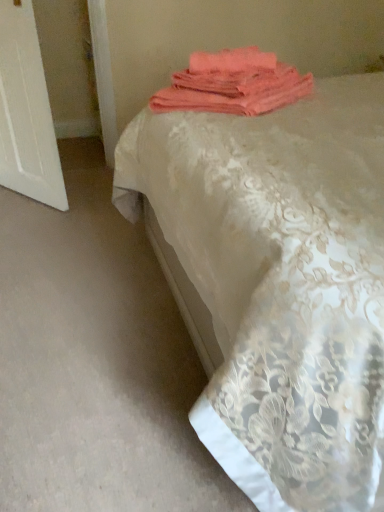
Question: Is point (4, 138) positioned closer to the camera than point (294, 68)?

Choices:
 (A) farther
 (B) closer

Answer: (B)

Question: From the image's perspective, relative to coral fabric towel at upper center, is white wood door at left above or below?

Choices:
 (A) below
 (B) above

Answer: (B)

Question: Considering the real-world distances, which object is farthest from the coral fabric towel at upper center?

Choices:
 (A) silky lace bedspread at center
 (B) white wood door at left

Answer: (B)

Question: Based on their relative distances, which object is farther from the coral fabric towel at upper center?

Choices:
 (A) white wood door at left
 (B) silky lace bedspread at center

Answer: (A)